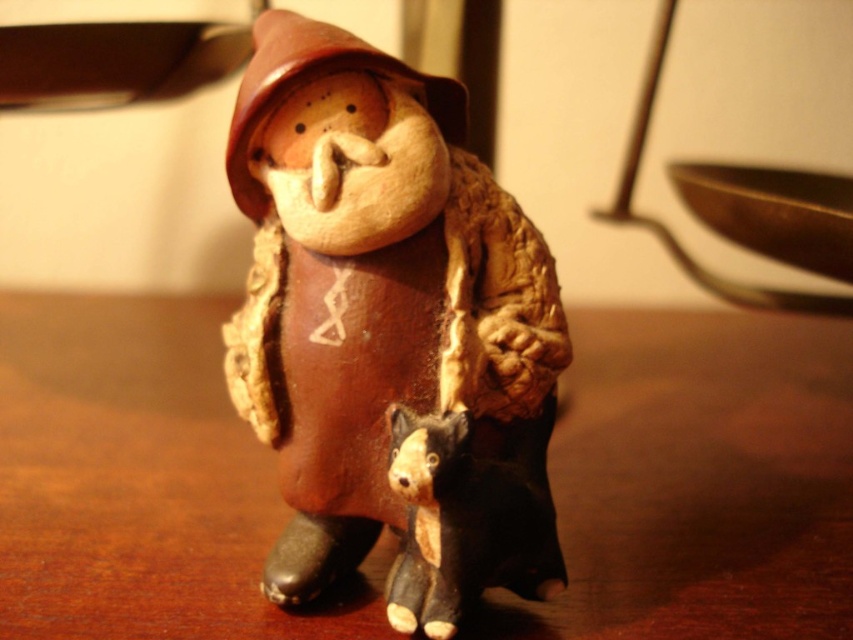
Question: Which point is farther to the camera?

Choices:
 (A) (547, 506)
 (B) (811, 477)

Answer: (B)

Question: Does matte clay figure at center appear over matte black dog at lower center?

Choices:
 (A) no
 (B) yes

Answer: (B)

Question: Which point is farther to the camera?

Choices:
 (A) (316, 376)
 (B) (403, 483)

Answer: (A)

Question: Does matte clay figure at center have a smaller size compared to matte black dog at lower center?

Choices:
 (A) yes
 (B) no

Answer: (B)

Question: Which of the following is the closest to the observer?

Choices:
 (A) (16, 445)
 (B) (506, 582)

Answer: (B)

Question: Observing the image, what is the correct spatial positioning of matte clay figure at center in reference to matte black dog at lower center?

Choices:
 (A) left
 (B) right

Answer: (A)